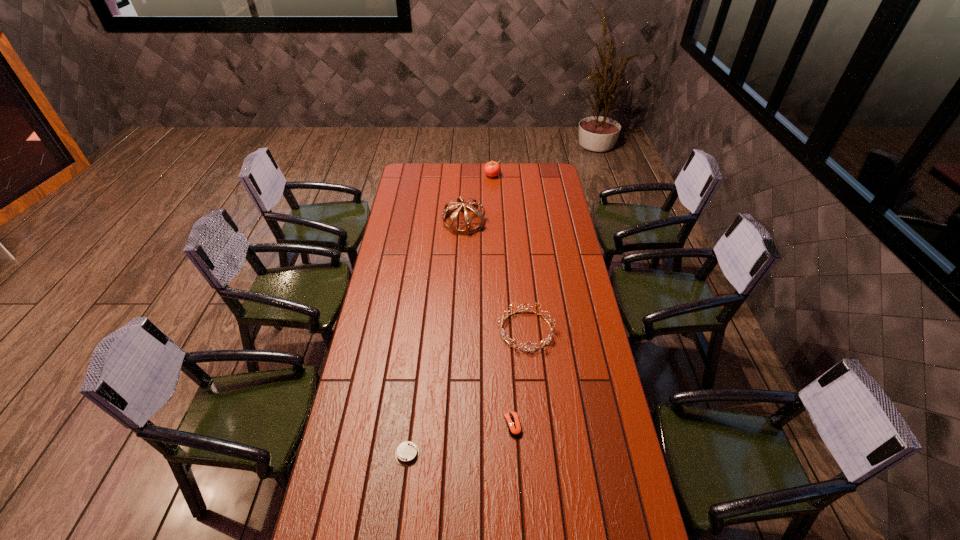
I want to click on vacant area that lies between the third nearest object and the chocolate cake, so click(467, 392).

Select which object appears as the closest to the tomato. Please provide its 2D coordinates. Your answer should be formatted as a tuple, i.e. [(x, y)], where the tuple contains the x and y coordinates of a point satisfying the conditions above.

[(450, 227)]

Where is `object that is the second closest to the chocolate cake`? This screenshot has width=960, height=540. object that is the second closest to the chocolate cake is located at coordinates (546, 341).

In order to click on blank space that satisfies the following two spatial constraints: 1. on the front-facing side of the nearer tiara; 2. on the front side of the computer mouse in this screenshot , I will do `click(535, 425)`.